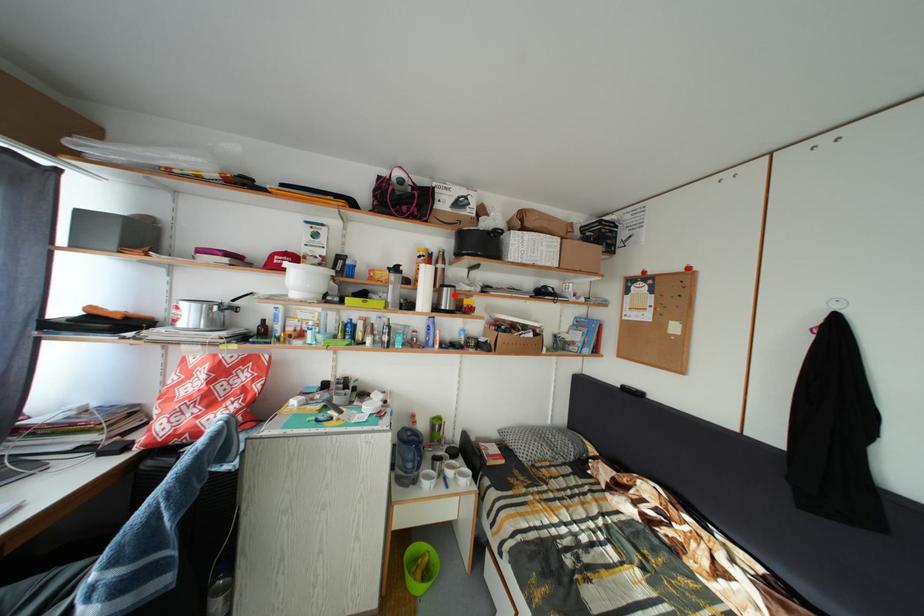
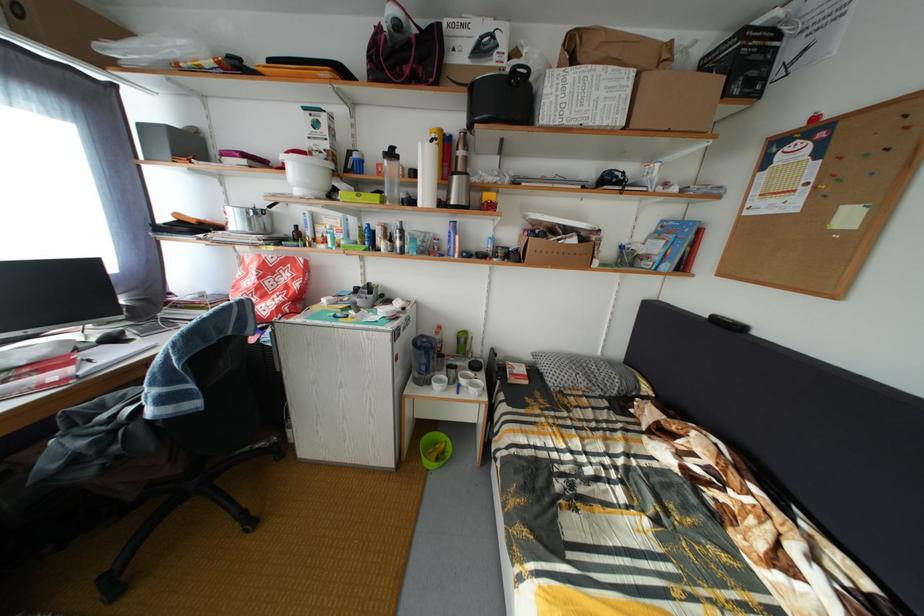
In the second image, find the point that corresponds to the highlighted location in the first image.

(464, 184)